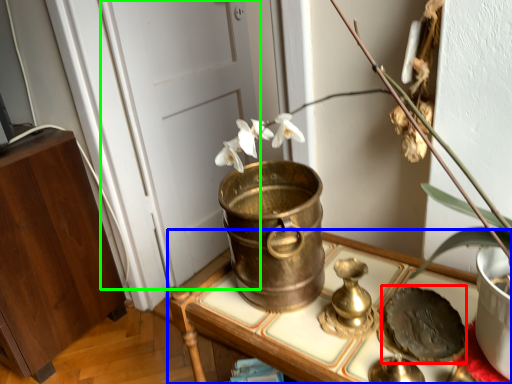
Question: Estimate the real-world distances between objects in this image. Which object is closer to food (highlighted by a red box), furniture (highlighted by a blue box) or door (highlighted by a green box)?

Choices:
 (A) furniture
 (B) door

Answer: (A)